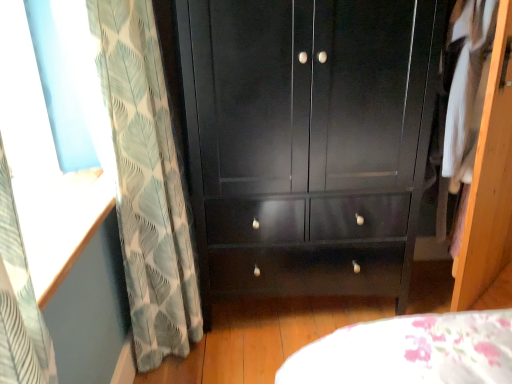
What do you see at coordinates (146, 182) in the screenshot? Image resolution: width=512 pixels, height=384 pixels. I see `green leaf-patterned curtain at left` at bounding box center [146, 182].

The width and height of the screenshot is (512, 384). In order to click on glossy black cupboard at center in this screenshot , I will do `click(308, 141)`.

This screenshot has width=512, height=384. In order to click on curtain above the glossy black cupboard at center (from a real-world perspective) in this screenshot , I will do `click(146, 182)`.

Does point (130, 55) come behind point (226, 189)?

That is False.

Can you tell me how much green leaf-patterned curtain at left and glossy black cupboard at center differ in facing direction?

They differ by 92.7 degrees in their facing directions.

Which point is more forward, (382, 15) or (471, 60)?

The point (382, 15) is closer.

How different are the orientations of glossy black cupboard at center and white fabric at right in degrees?

47.6 degrees.

From a real-world perspective, which object stands above the other?

From a 3D spatial view, white fabric at right is above.

Measure the distance between glossy black cupboard at center and white fabric at right.

Result: glossy black cupboard at center is 16.88 inches away from white fabric at right.

Looking at the image, does green leaf-patterned curtain at left seem bigger or smaller compared to white fabric at right?

Clearly, green leaf-patterned curtain at left is larger in size than white fabric at right.

Image resolution: width=512 pixels, height=384 pixels. I want to click on clothing behind the green leaf-patterned curtain at left, so click(462, 99).

Is green leaf-patterned curtain at left touching white fabric at right?

green leaf-patterned curtain at left is not next to white fabric at right, and they're not touching.

Which object is closer to the camera taking this photo, green leaf-patterned curtain at left or white fabric at right?

green leaf-patterned curtain at left is in front.

Is white fabric at right taller or shorter than glossy black cupboard at center?

white fabric at right is shorter than glossy black cupboard at center.

How much distance is there between white fabric at right and glossy black cupboard at center?

The distance of white fabric at right from glossy black cupboard at center is 42.87 centimeters.

Would you consider white fabric at right to be distant from glossy black cupboard at center?

Actually, white fabric at right and glossy black cupboard at center are a little close together.

Between white fabric at right and glossy black cupboard at center, which one has smaller size?

white fabric at right is smaller.

Is white fabric at right not inside green leaf-patterned curtain at left?

Yes, white fabric at right is not within green leaf-patterned curtain at left.

Is point (444, 104) closer to camera compared to point (148, 10)?

No, it is behind (148, 10).

Can you tell me how much white fabric at right and green leaf-patterned curtain at left differ in facing direction?

There is a 140-degree angle between the facing directions of white fabric at right and green leaf-patterned curtain at left.

Based on their positions, is white fabric at right located to the left or right of green leaf-patterned curtain at left?

From the image, it's evident that white fabric at right is to the right of green leaf-patterned curtain at left.

Is glossy black cupboard at center behind green leaf-patterned curtain at left?

Yes, glossy black cupboard at center is further from the camera.

Is glossy black cupboard at center shorter than green leaf-patterned curtain at left?

Correct, glossy black cupboard at center is not as tall as green leaf-patterned curtain at left.

Is glossy black cupboard at center not inside green leaf-patterned curtain at left?

Indeed, glossy black cupboard at center is completely outside green leaf-patterned curtain at left.

Can you confirm if glossy black cupboard at center is wider than green leaf-patterned curtain at left?

Yes.

At what (x,y) coordinates should I click in order to perform the action: click on cupboard that appears on the right of green leaf-patterned curtain at left. Please return your answer as a coordinate pair (x, y). Looking at the image, I should click on (308, 141).

Image resolution: width=512 pixels, height=384 pixels. What are the coordinates of `cupboard below the white fabric at right (from the image's perspective)` in the screenshot? It's located at (308, 141).

From the image, which object appears to be farther from white fabric at right, glossy black cupboard at center or green leaf-patterned curtain at left?

green leaf-patterned curtain at left.

Estimate the real-world distances between objects in this image. Which object is further from green leaf-patterned curtain at left, glossy black cupboard at center or white fabric at right?

white fabric at right lies further to green leaf-patterned curtain at left than the other object.

From the image, which object appears to be nearer to glossy black cupboard at center, green leaf-patterned curtain at left or white fabric at right?

Among the two, green leaf-patterned curtain at left is located nearer to glossy black cupboard at center.

Estimate the real-world distances between objects in this image. Which object is further from white fabric at right, green leaf-patterned curtain at left or glossy black cupboard at center?

Among the two, green leaf-patterned curtain at left is located further to white fabric at right.

In the scene shown: When comparing their distances from glossy black cupboard at center, does white fabric at right or green leaf-patterned curtain at left seem further?

white fabric at right is positioned further to the anchor glossy black cupboard at center.

From the image, which object appears to be farther from green leaf-patterned curtain at left, white fabric at right or glossy black cupboard at center?

white fabric at right is further to green leaf-patterned curtain at left.

At what (x,y) coordinates should I click in order to perform the action: click on cupboard between green leaf-patterned curtain at left and white fabric at right from left to right. Please return your answer as a coordinate pair (x, y). Looking at the image, I should click on (308, 141).